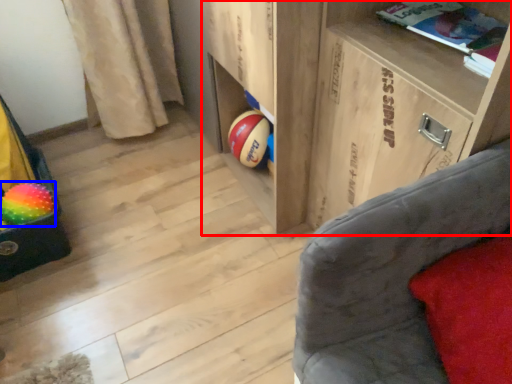
Question: Among these objects, which one is nearest to the camera, shelf (highlighted by a red box) or beach ball (highlighted by a blue box)?

Choices:
 (A) shelf
 (B) beach ball

Answer: (A)